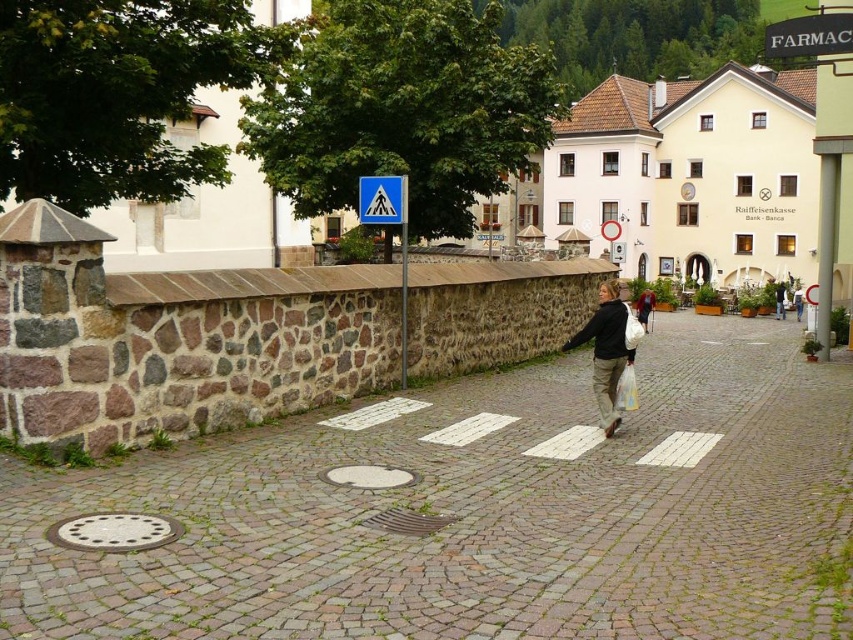
Between point (659, 355) and point (799, 32), which one is positioned in front?

Point (799, 32) is in front.

Is brown cobblestone pavement at center to the left of black plastic sign at upper right from the viewer's perspective?

Yes, brown cobblestone pavement at center is to the left of black plastic sign at upper right.

Image resolution: width=853 pixels, height=640 pixels. What are the coordinates of `brown cobblestone pavement at center` in the screenshot? It's located at (479, 513).

Locate an element on the screen. The height and width of the screenshot is (640, 853). brown cobblestone pavement at center is located at coordinates (479, 513).

Which is above, blue plastic pedestrian sign at upper center or metal pedestrian crossing sign at center?

metal pedestrian crossing sign at center is higher up.

What do you see at coordinates (387, 225) in the screenshot?
I see `blue plastic pedestrian sign at upper center` at bounding box center [387, 225].

Where is `blue plastic pedestrian sign at upper center`? The width and height of the screenshot is (853, 640). blue plastic pedestrian sign at upper center is located at coordinates 387,225.

Does point (608, 417) come closer to viewer compared to point (840, 16)?

Yes, point (608, 417) is closer to viewer.

Who is positioned more to the right, matte black jacket at center or black plastic sign at upper right?

black plastic sign at upper right is more to the right.

Is point (608, 420) less distant than point (808, 22)?

That is True.

Locate an element on the screen. matte black jacket at center is located at coordinates (606, 352).